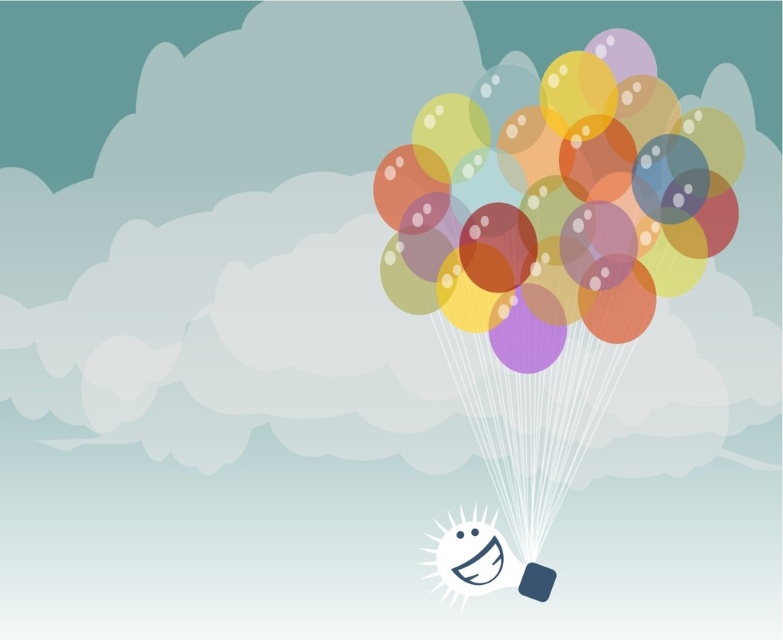
Who is positioned more to the right, translucent paper balloons at upper center or smooth blue square at lower right?

From the viewer's perspective, translucent paper balloons at upper center appears more on the right side.

Does translucent paper balloons at upper center have a smaller size compared to smooth blue square at lower right?

No, translucent paper balloons at upper center is not smaller than smooth blue square at lower right.

What are the coordinates of `translucent paper balloons at upper center` in the screenshot? It's located at (565, 204).